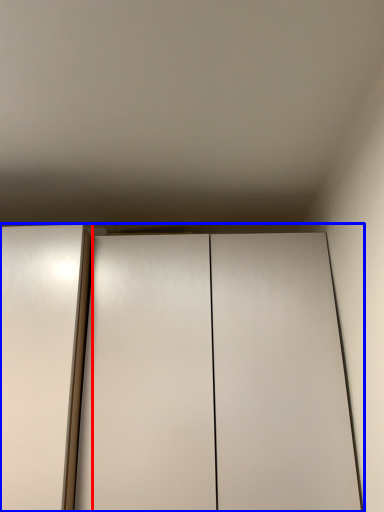
Question: Which point is closer to the camera, elevator (highlighted by a red box) or cupboard (highlighted by a blue box)?

Choices:
 (A) elevator
 (B) cupboard

Answer: (A)